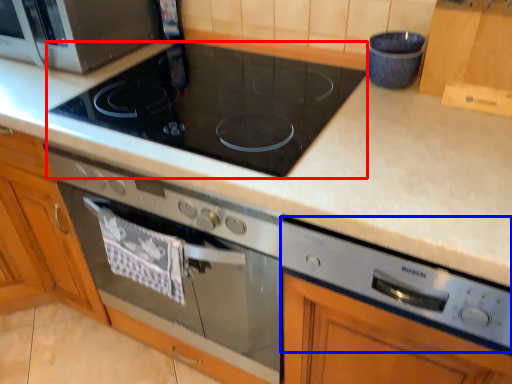
Question: Which of the following is the closest to the observer, gas stove (highlighted by a red box) or appliance (highlighted by a blue box)?

Choices:
 (A) gas stove
 (B) appliance

Answer: (B)